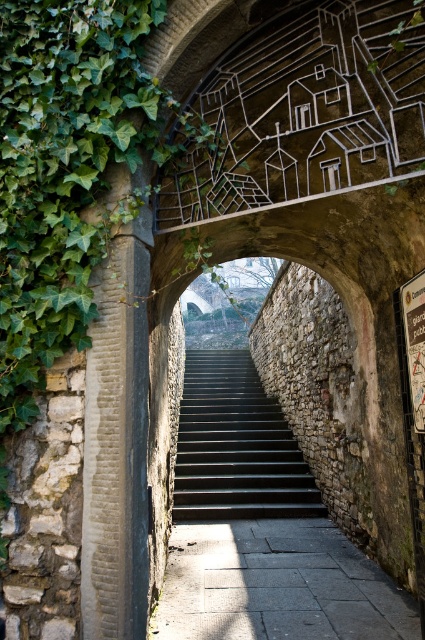
Is gray concrete path at center bigger than dark gray stone stairs at center?

No, gray concrete path at center is not bigger than dark gray stone stairs at center.

Is point (405, 637) less distant than point (272, 490)?

Yes, point (405, 637) is closer to viewer.

Which is in front, point (278, 541) or point (260, 433)?

Point (278, 541) is more forward.

Locate an element on the screen. The image size is (425, 640). gray concrete path at center is located at coordinates (275, 584).